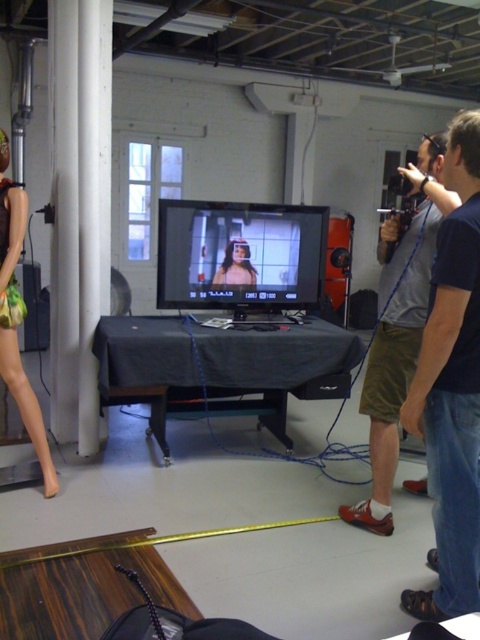
Looking at this image, is jeans at right positioned in front of matte plastic mannequin at left?

Yes.

Is jeans at right positioned at the back of matte plastic mannequin at left?

No, jeans at right is in front of matte plastic mannequin at left.

Locate an element on the screen. This screenshot has width=480, height=640. jeans at right is located at coordinates (452, 388).

Find the location of `jeans at right`. jeans at right is located at coordinates (452, 388).

Can you confirm if matte khaki shorts at right is thinner than matte black woman at center?

No.

Is matte khaki shorts at right positioned behind matte black woman at center?

No, it is in front of matte black woman at center.

Who is more forward, (420, 147) or (240, 241)?

Positioned in front is point (420, 147).

Locate an element on the screen. matte khaki shorts at right is located at coordinates (398, 326).

Can you confirm if jeans at right is wider than matte khaki shorts at right?

In fact, jeans at right might be narrower than matte khaki shorts at right.

Identify the location of jeans at right. (452, 388).

Find the location of `jeans at right`. jeans at right is located at coordinates (452, 388).